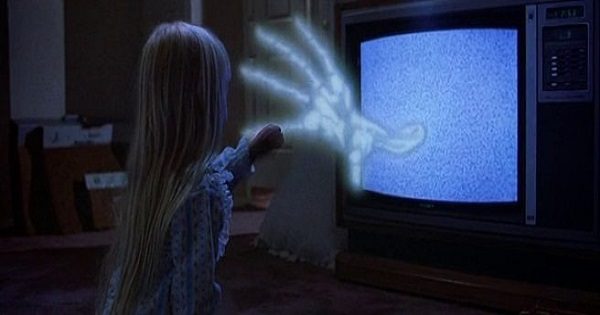
In order to click on white light reflecting on floor in this screenshot , I will do `click(251, 220)`, `click(261, 202)`.